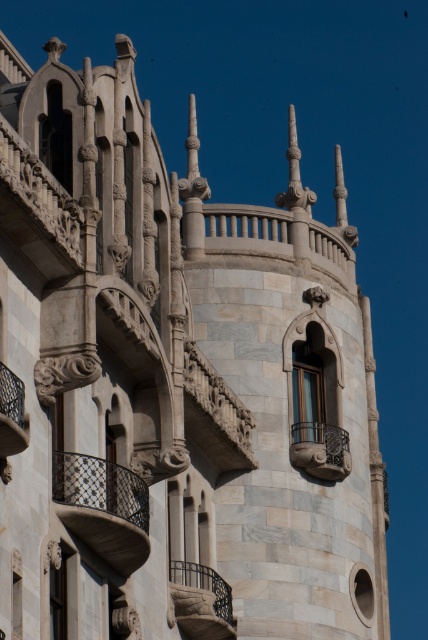
You are an architect examining the building and need to determine which balcony has a greater width. You observe the carved stone balcony at lower center and the polished metal balcony at lower left. Which one is wider?

The carved stone balcony at lower center is wider than the polished metal balcony at lower left, as its width surpasses the latter.

You are standing at the camera position looking at the building. There is a point labeled as point [193,572] on the building facade. If you want to throw a ball to hit that exact point, considering the distance, is it feasible for an average person?

The distance between point [193,572] and the camera is 68.82 meters. An average person cannot throw a ball that far, so it is not feasible.